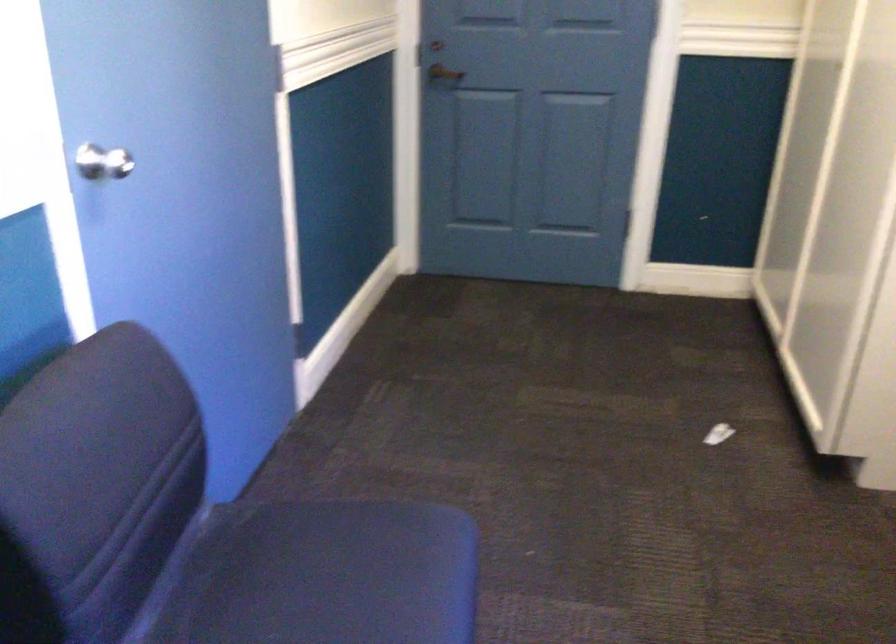
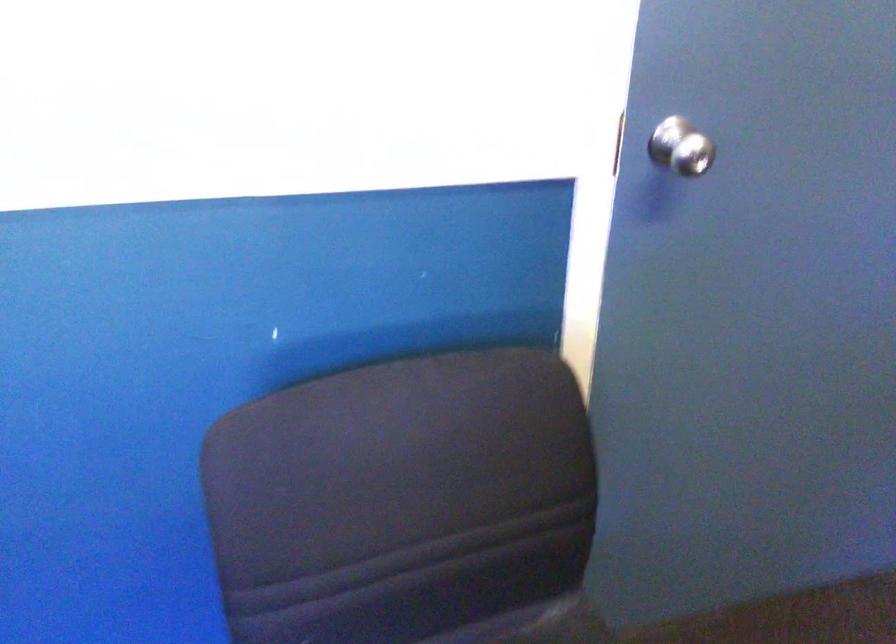
Find the pixel in the second image that matches (109,163) in the first image.

(681, 147)